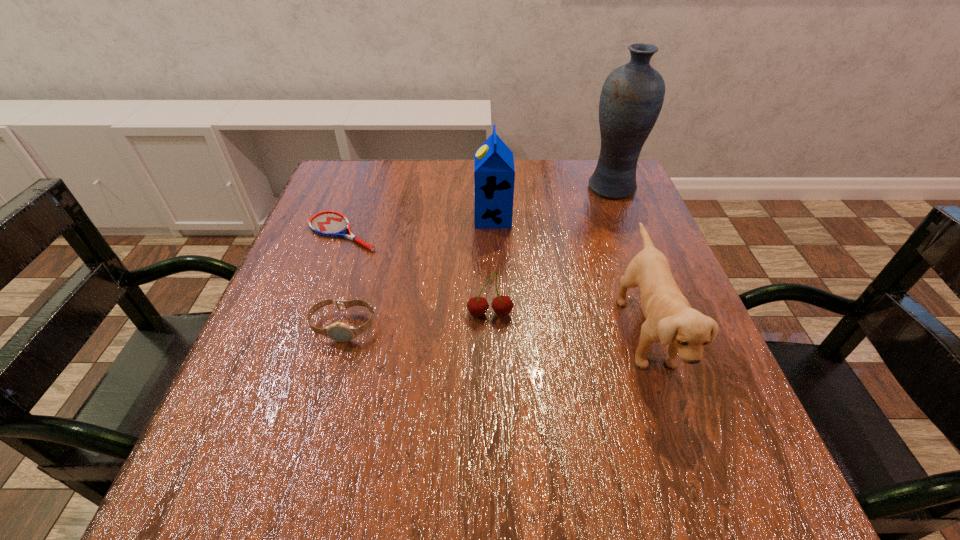
This screenshot has width=960, height=540. Identify the location of tennis racket at the left edge. (327, 223).

I want to click on vase at the right edge, so (632, 96).

Where is `puppy located in the right edge section of the desktop`? puppy located in the right edge section of the desktop is located at coordinates (670, 319).

The image size is (960, 540). In order to click on object that is at the far right corner in this screenshot , I will do point(632,96).

Where is `vacant space at the far edge of the desktop`? The height and width of the screenshot is (540, 960). vacant space at the far edge of the desktop is located at coordinates (538, 164).

This screenshot has height=540, width=960. In order to click on vacant space at the near edge in this screenshot , I will do `click(601, 509)`.

You are a GUI agent. You are given a task and a screenshot of the screen. Output one action in this format:
    pyautogui.click(x=<x>, y=<y>)
    Task: Click on the free location at the right edge
    Image resolution: width=960 pixels, height=540 pixels.
    Given the screenshot: What is the action you would take?
    [730, 418]

Find the location of a particular element. Image resolution: width=960 pixels, height=540 pixels. free spot at the near left corner of the desktop is located at coordinates pyautogui.click(x=235, y=482).

You are a GUI agent. You are given a task and a screenshot of the screen. Output one action in this format:
    pyautogui.click(x=<x>, y=<y>)
    Task: Click on the free space between the watch and the third tallest object
    
    Given the screenshot: What is the action you would take?
    pyautogui.click(x=494, y=329)

This screenshot has height=540, width=960. Find the location of `vacant area that lies between the third tallest object and the carton`. vacant area that lies between the third tallest object and the carton is located at coordinates (569, 275).